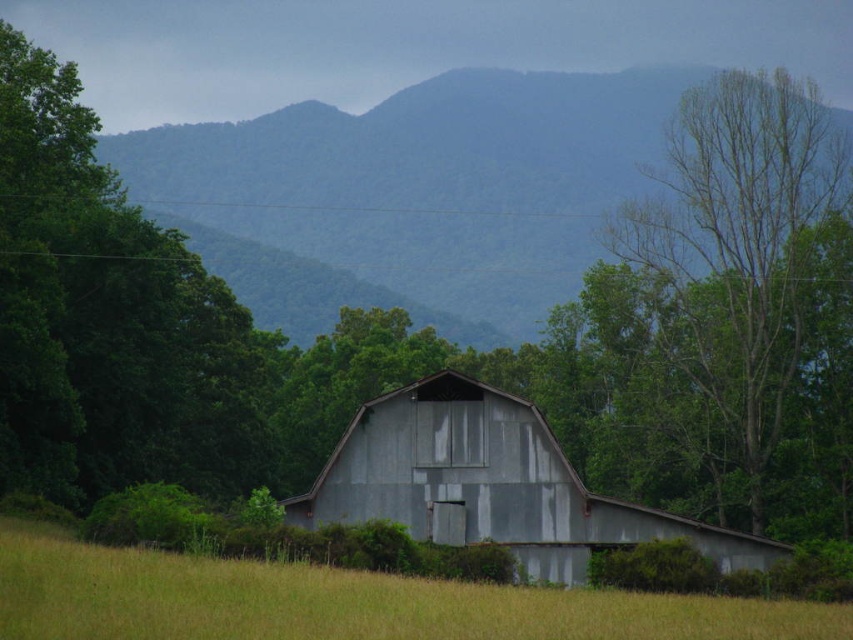
Question: Does green leafy tree at left appear on the right side of bare wood tree at right?

Choices:
 (A) yes
 (B) no

Answer: (B)

Question: Which of the following is the closest to the observer?

Choices:
 (A) bare wood tree at right
 (B) yellow grass at center
 (C) rusty metal barn at center
 (D) green forested mountain at upper center

Answer: (B)

Question: Among these points, which one is farthest from the camera?

Choices:
 (A) (775, 368)
 (B) (61, 122)
 (C) (360, 480)

Answer: (A)

Question: Which of the following is the closest to the observer?

Choices:
 (A) (57, 637)
 (B) (838, 179)

Answer: (A)

Question: Is the position of green forested mountain at upper center less distant than that of rusty metal barn at center?

Choices:
 (A) yes
 (B) no

Answer: (B)

Question: Where is bare wood tree at right located in relation to yellow grass at center in the image?

Choices:
 (A) right
 (B) left

Answer: (A)